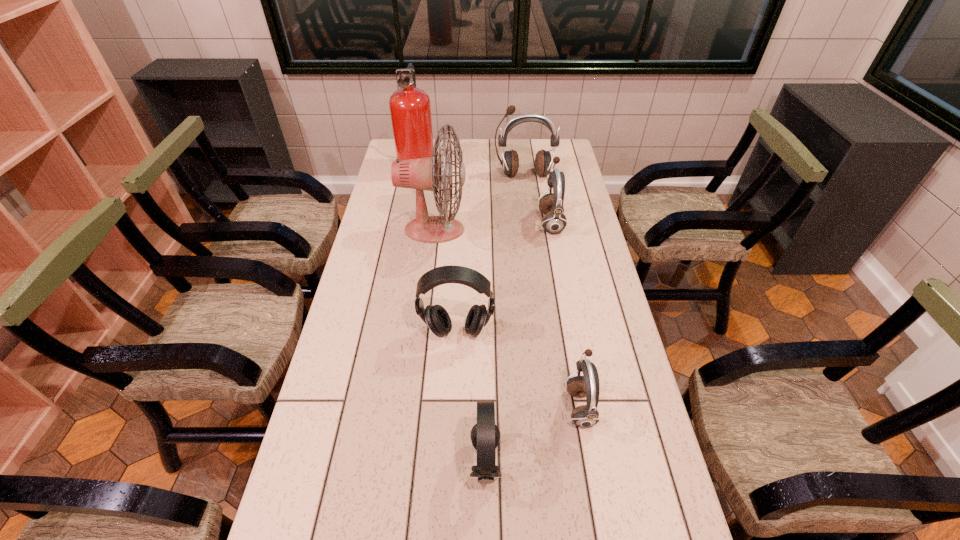
Where is `empty location between the smaller black earphone and the tallest earphone`? The height and width of the screenshot is (540, 960). empty location between the smaller black earphone and the tallest earphone is located at coordinates (505, 318).

Find the location of a particular element. Image resolution: width=960 pixels, height=540 pixels. vacant space in between the second biggest brown earphone and the red fire extinguisher is located at coordinates (485, 193).

Where is `free space between the nearest brown earphone and the third nearest object`? free space between the nearest brown earphone and the third nearest object is located at coordinates (518, 369).

Locate an element on the screen. The width and height of the screenshot is (960, 540). empty space that is in between the nearest brown earphone and the third farthest earphone is located at coordinates (518, 369).

Where is `vacant point located between the red fire extinguisher and the fan`? This screenshot has height=540, width=960. vacant point located between the red fire extinguisher and the fan is located at coordinates (426, 197).

Where is `free space between the fan and the nearer black earphone`? free space between the fan and the nearer black earphone is located at coordinates (460, 346).

Image resolution: width=960 pixels, height=540 pixels. Identify the location of vacant area between the smaller black earphone and the third farthest earphone. (470, 396).

The height and width of the screenshot is (540, 960). I want to click on object that is the fifth closest one to the fan, so pyautogui.click(x=584, y=416).

Locate an element on the screen. The image size is (960, 540). object that is the sixth closest one to the second smallest brown earphone is located at coordinates (485, 435).

I want to click on earphone that is the fourth nearest to the fan, so click(x=584, y=416).